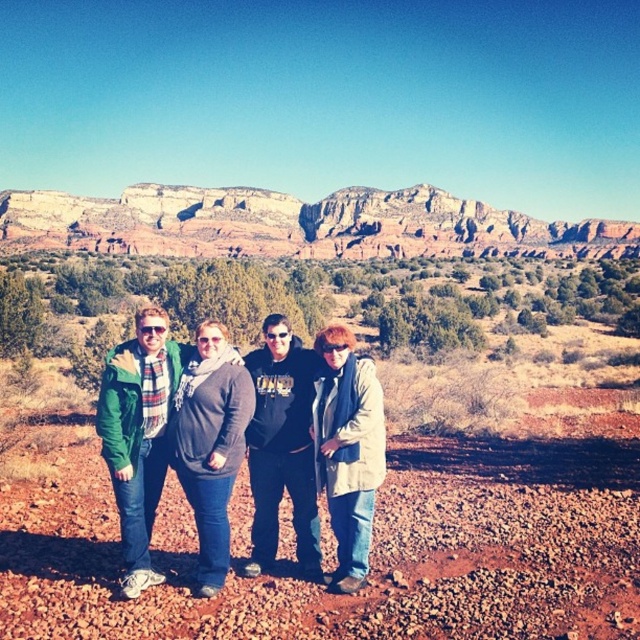
Which is more to the left, reddish-brown gravel at center or black matte hoodie at center?

Positioned to the left is black matte hoodie at center.

Who is taller, reddish-brown gravel at center or black matte hoodie at center?

black matte hoodie at center is taller.

Does point (6, 545) lie behind point (288, 460)?

That is False.

I want to click on reddish-brown gravel at center, so click(371, 552).

From the picture: Is reddish-brown gravel at center smaller than green plaid scarf at left?

No, reddish-brown gravel at center is not smaller than green plaid scarf at left.

In order to click on reddish-brown gravel at center in this screenshot , I will do `click(371, 552)`.

Does green plaid scarf at left have a larger size compared to black matte hoodie at center?

Correct, green plaid scarf at left is larger in size than black matte hoodie at center.

Does point (156, 412) come farther from viewer compared to point (278, 403)?

That is False.

Locate an element on the screen. This screenshot has height=640, width=640. green plaid scarf at left is located at coordinates (140, 433).